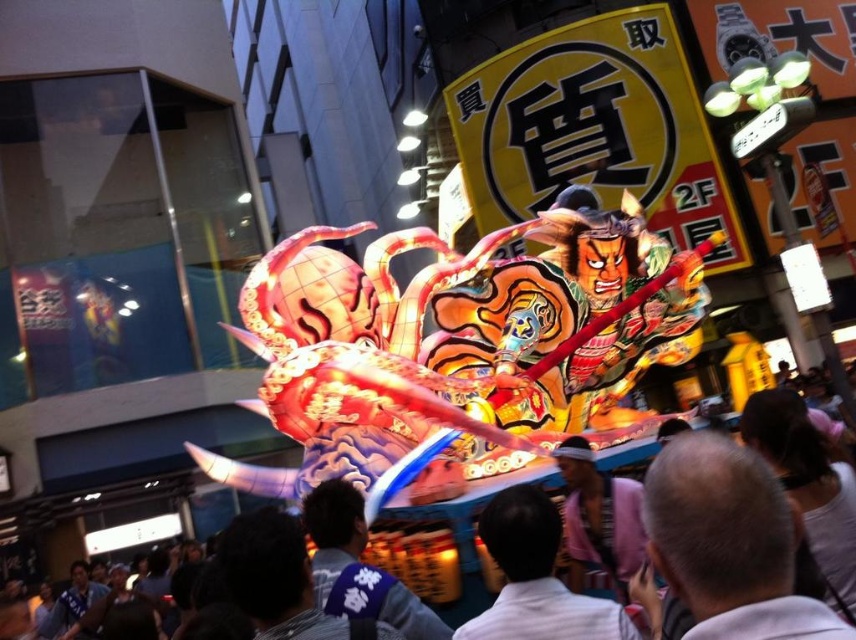
Question: Is dark blue fabric at center wider than silky fabric crowd at center?

Choices:
 (A) no
 (B) yes

Answer: (A)

Question: Does gray hair at lower right have a greater width compared to pink satin jacket at center?

Choices:
 (A) no
 (B) yes

Answer: (B)

Question: Can you confirm if dark blue fabric at center is positioned below pink satin jacket at center?

Choices:
 (A) no
 (B) yes

Answer: (B)

Question: Among these points, which one is nearest to the camera?

Choices:
 (A) (635, 444)
 (B) (658, 522)
 (C) (623, 534)

Answer: (B)

Question: Which object is positioned closest to the pink satin jacket at center?

Choices:
 (A) silky fabric crowd at center
 (B) white cotton shirt at lower center
 (C) gray hair at lower right
 (D) dark blue fabric at center

Answer: (A)

Question: Which is farther from the pink satin jacket at center?

Choices:
 (A) white cotton shirt at lower center
 (B) silky fabric crowd at center
 (C) dark blue fabric at center

Answer: (C)